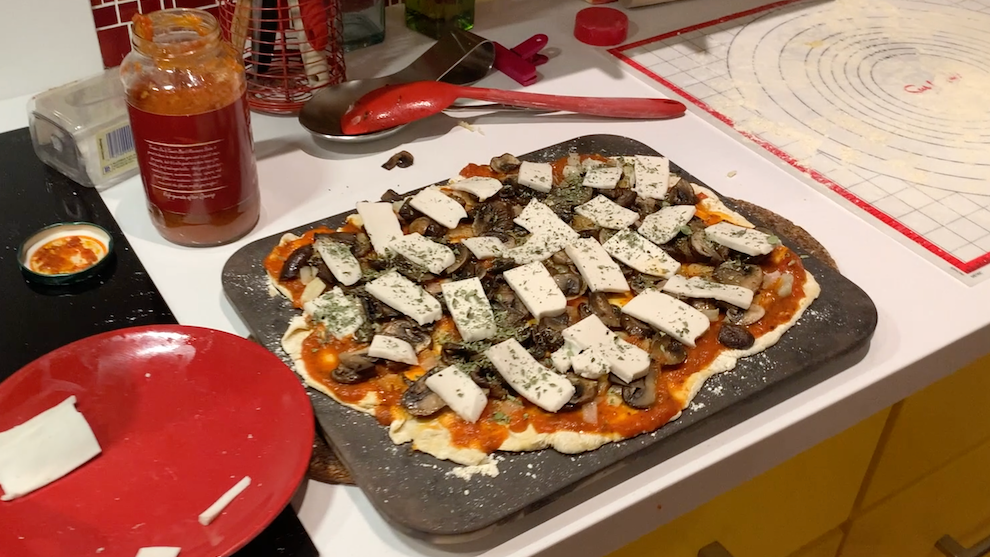
The width and height of the screenshot is (990, 557). Identify the location of countertop. (193, 258).